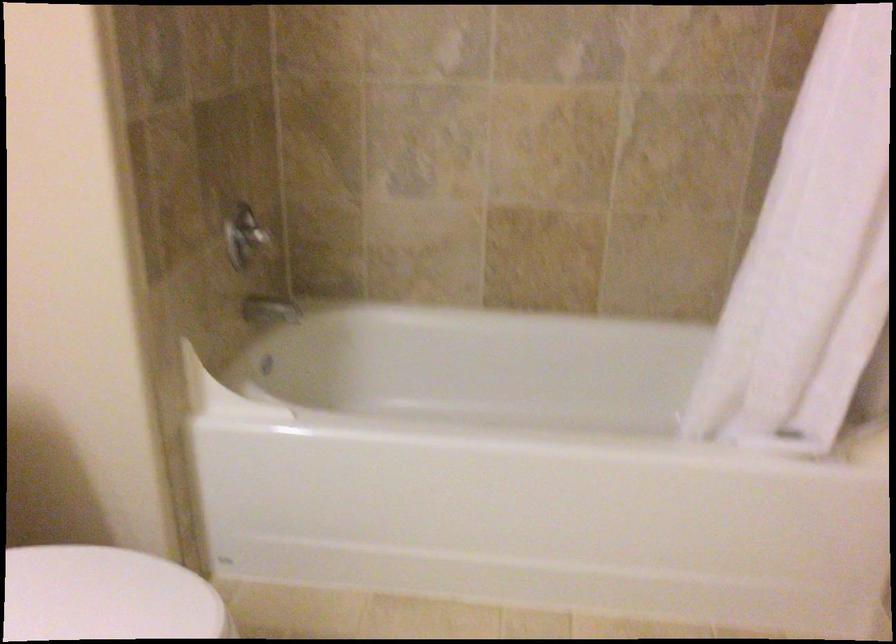
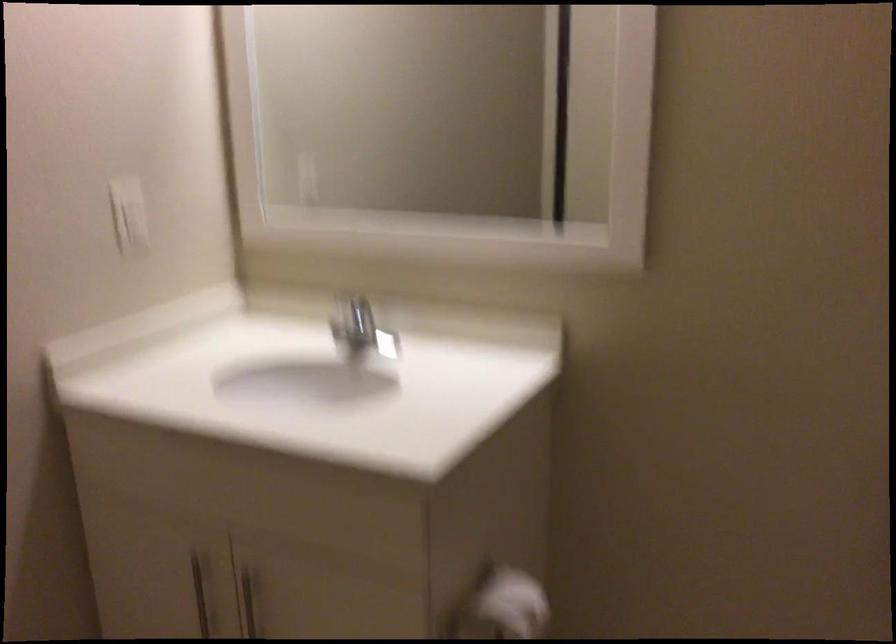
The images are taken continuously from a first-person perspective. In which direction is your viewpoint rotating?

The camera's rotation is toward left-down.